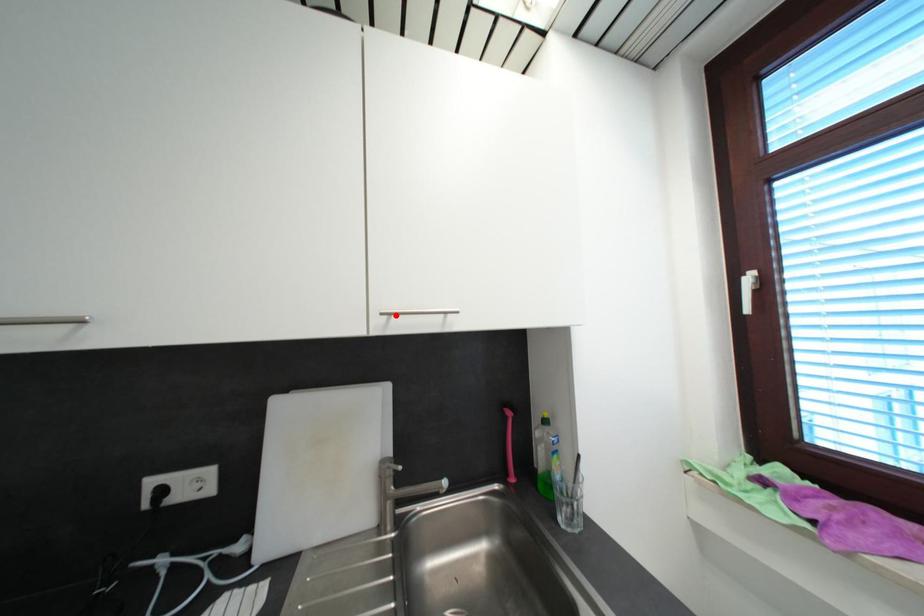
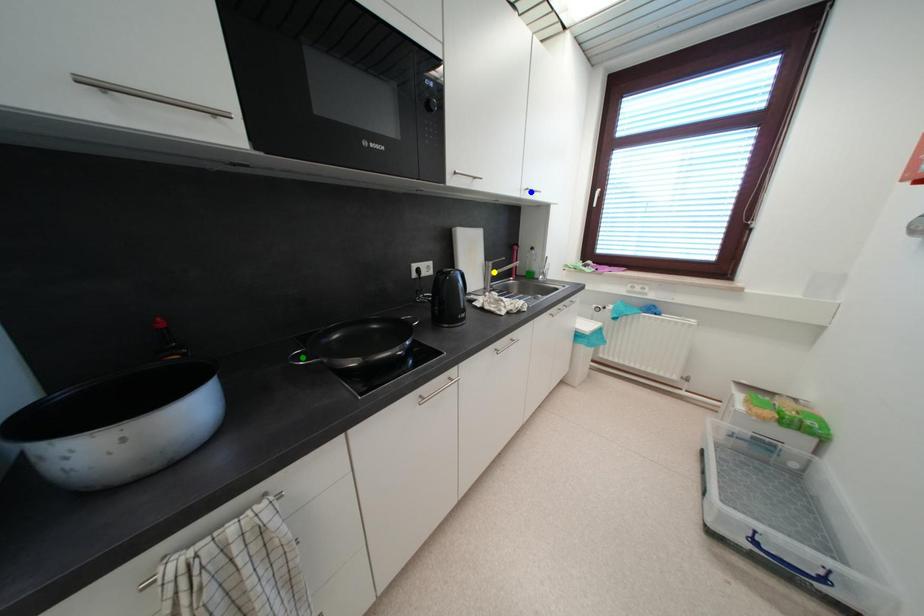
Question: I am providing you with two images of the same scene from different viewpoints. A red point is marked on the first image. You are given multiple points on the second image. In image 2, which mark is for the same physical point as the one in image 1?

Choices:
 (A) blue point
 (B) yellow point
 (C) green point

Answer: (A)